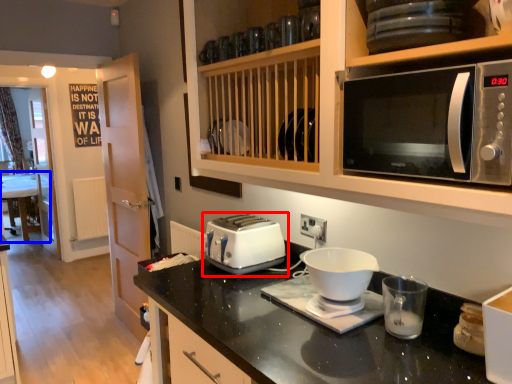
Question: Which point is closer to the camera, toaster (highlighted by a red box) or table (highlighted by a blue box)?

Choices:
 (A) toaster
 (B) table

Answer: (A)